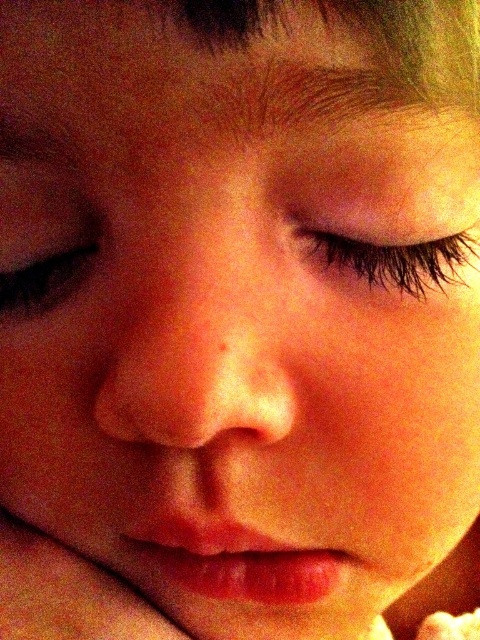
Question: Is black eyelashes at center bigger than brown matte eye at left?

Choices:
 (A) no
 (B) yes

Answer: (B)

Question: Which point appears closest to the camera in this image?

Choices:
 (A) coord(349,244)
 (B) coord(23,300)

Answer: (A)

Question: Which of the following is the closest to the observer?

Choices:
 (A) (49, 291)
 (B) (465, 232)

Answer: (B)

Question: Is black eyelashes at center behind brown matte eye at left?

Choices:
 (A) no
 (B) yes

Answer: (A)

Question: Among these objects, which one is nearest to the camera?

Choices:
 (A) black eyelashes at center
 (B) brown matte eye at left

Answer: (A)

Question: Is black eyelashes at center smaller than brown matte eye at left?

Choices:
 (A) yes
 (B) no

Answer: (B)